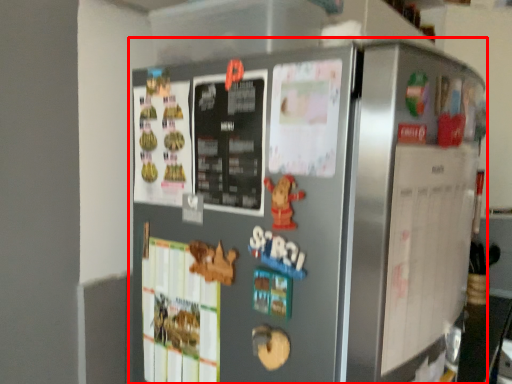
Question: From the image's perspective, what is the correct spatial positioning of refrigerator (annotated by the red box) in reference to bulletin board?

Choices:
 (A) below
 (B) above

Answer: (A)